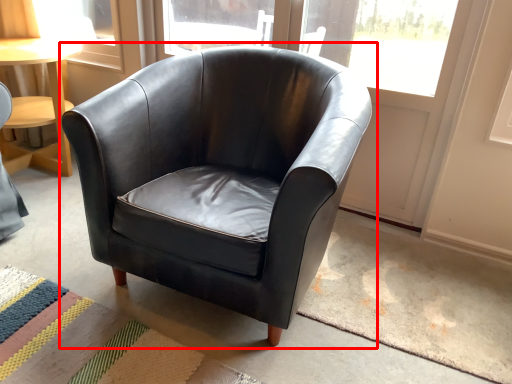
Question: Considering the relative positions of chair (annotated by the red box) and mat in the image provided, where is chair (annotated by the red box) located with respect to the staircase?

Choices:
 (A) left
 (B) right

Answer: (B)